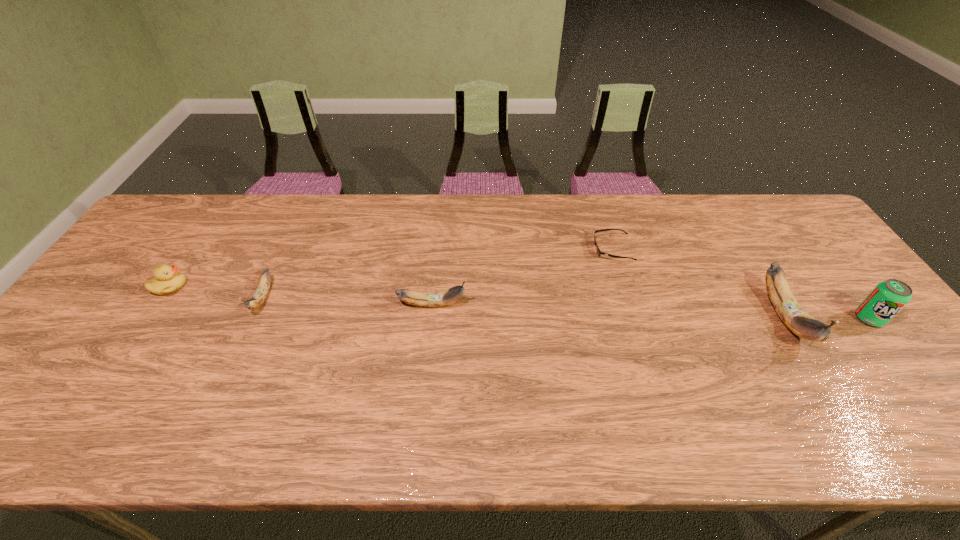
Where is `object positioned at the left edge`? The image size is (960, 540). object positioned at the left edge is located at coordinates (167, 280).

Where is `object that is at the right edge`? This screenshot has height=540, width=960. object that is at the right edge is located at coordinates (888, 297).

At what (x,y) coordinates should I click in order to perform the action: click on vacant space at the far edge of the desktop. Please return your answer as a coordinate pair (x, y). The width and height of the screenshot is (960, 540). Looking at the image, I should click on (546, 216).

The image size is (960, 540). In order to click on vacant space at the near edge of the desktop in this screenshot , I will do `click(798, 404)`.

Locate an element on the screen. free region at the left edge of the desktop is located at coordinates (135, 247).

Locate an element on the screen. The height and width of the screenshot is (540, 960). vacant region at the right edge of the desktop is located at coordinates 851,345.

Locate an element on the screen. The image size is (960, 540). free space at the far left corner of the desktop is located at coordinates (194, 202).

Where is `vacant space at the near left corner of the desktop`? Image resolution: width=960 pixels, height=540 pixels. vacant space at the near left corner of the desktop is located at coordinates (79, 382).

This screenshot has width=960, height=540. I want to click on vacant point at the near right corner, so click(890, 396).

I want to click on free spot between the leftmost object and the fifth object from right to left, so (x=216, y=292).